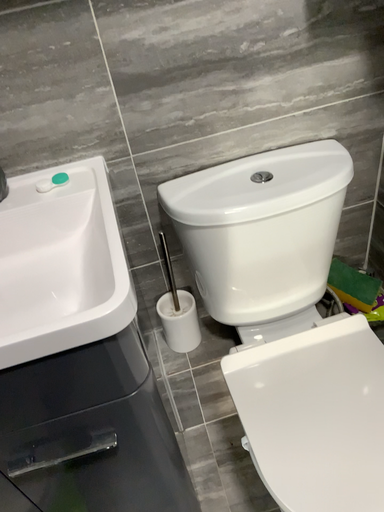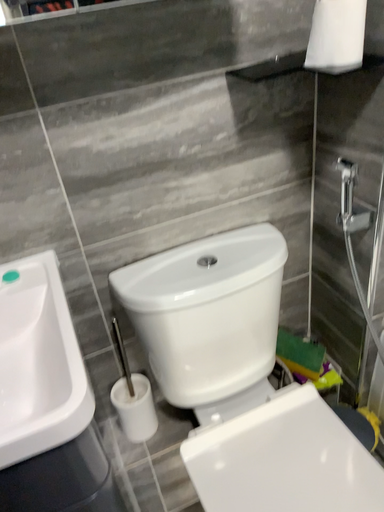
Question: Which way did the camera rotate in the video?

Choices:
 (A) rotated right
 (B) rotated left

Answer: (A)